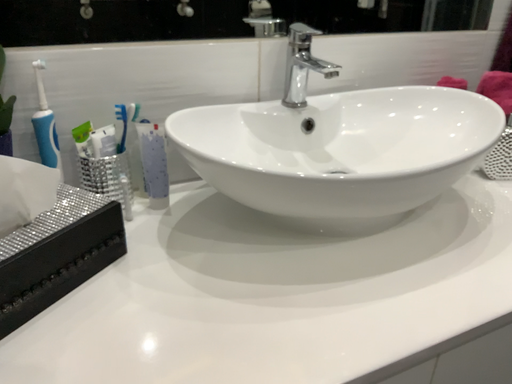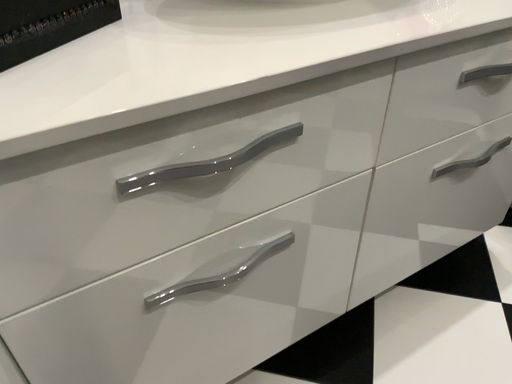
Question: Which way did the camera rotate in the video?

Choices:
 (A) rotated downward
 (B) rotated upward

Answer: (A)